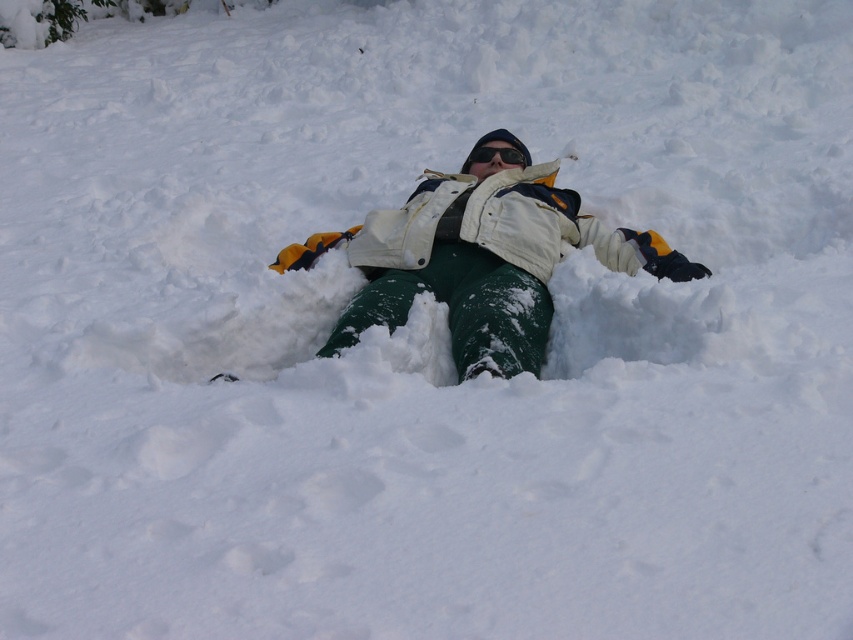
Question: Which point is farther to the camera?

Choices:
 (A) black reflective goggles at center
 (B) white fleece jacket at center

Answer: (A)

Question: Can you confirm if white fleece jacket at center is wider than black reflective goggles at center?

Choices:
 (A) no
 (B) yes

Answer: (B)

Question: Which of the following is the closest to the observer?

Choices:
 (A) (521, 156)
 (B) (398, 305)

Answer: (B)

Question: Is white fleece jacket at center in front of black reflective goggles at center?

Choices:
 (A) yes
 (B) no

Answer: (A)

Question: Is white fleece jacket at center thinner than black reflective goggles at center?

Choices:
 (A) yes
 (B) no

Answer: (B)